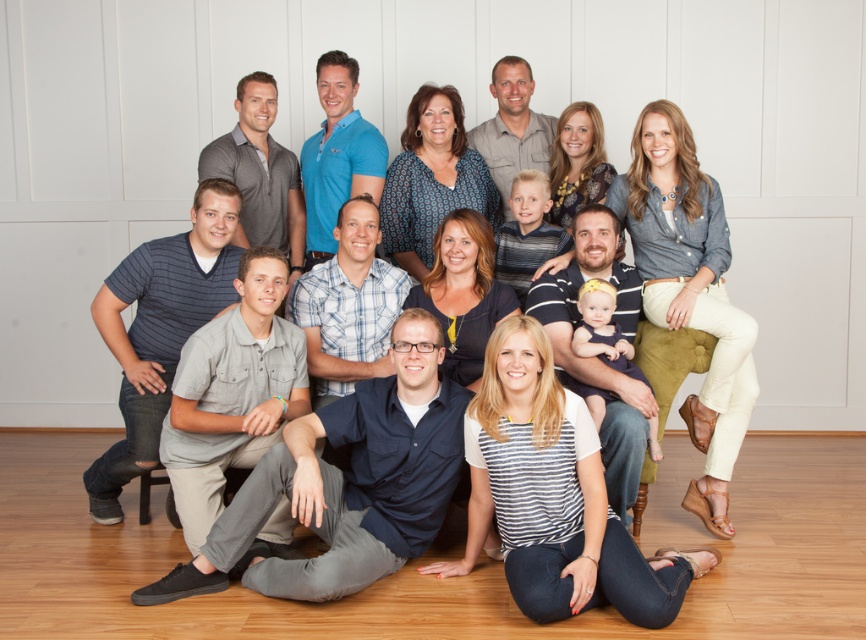
Question: Does dark blue shirt at center appear on the left side of matte blue shirt at center?

Choices:
 (A) no
 (B) yes

Answer: (B)

Question: Can you confirm if dark blue shirt at center is positioned below matte blue shirt at center?

Choices:
 (A) yes
 (B) no

Answer: (A)

Question: Does dark blue shirt at center come in front of matte blue shirt at center?

Choices:
 (A) yes
 (B) no

Answer: (A)

Question: Which point is closer to the camera?

Choices:
 (A) (700, 268)
 (B) (440, 522)

Answer: (B)

Question: Among these points, which one is nearest to the camera?

Choices:
 (A) (706, 268)
 (B) (221, 573)

Answer: (B)